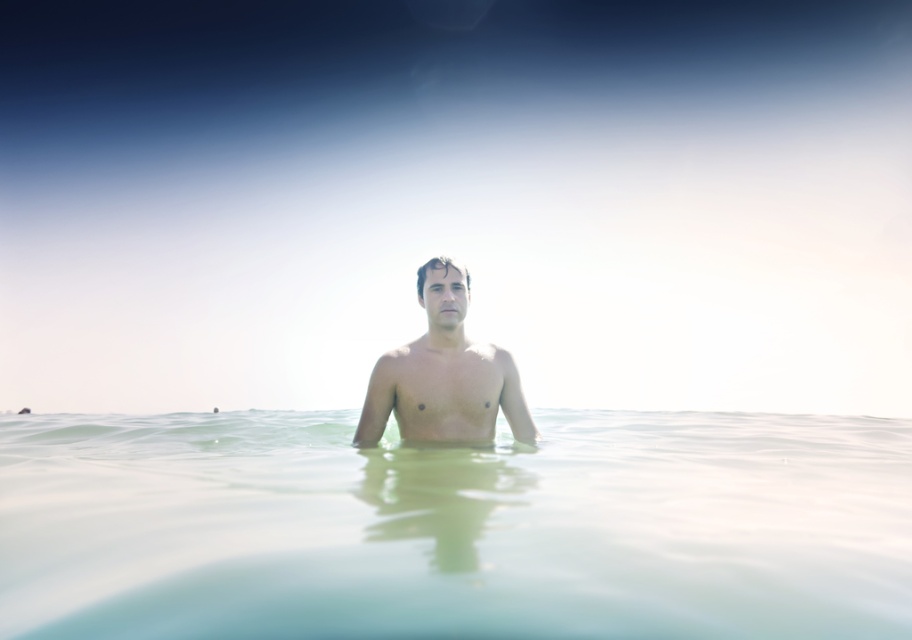
You are a swimmer planning to dive into the water at the beach shown in the image. The coordinates given are in the format of normalized coordinates where the bottom left corner is the origin. The point at point (456, 528) is marked as clear water at center. Which direction should you swim to reach the clear water at center from your current position at the bottom left corner?

Since the point at point (456, 528) marks clear water at center, you should swim towards the right and upwards from the bottom left corner to reach the clear water at center.

You are a lifeguard on duty and need to assess the distance between the clear water at center and the smooth skin man at center in the image. Based on the scene, can you confirm if the distance is less than 30 inches?

The clear water at center is 26.92 inches from the smooth skin man at center, so yes, the distance is less than 30 inches.

You are standing at the beach and want to reach the point marked as point [296,614]. If you can walk 3 feet per second, how many seconds will it take you to reach that point?

The distance between you and point [296,614] is 5.60 feet. At a walking speed of 3 feet per second, it will take approximately 1.87 seconds to reach the point.